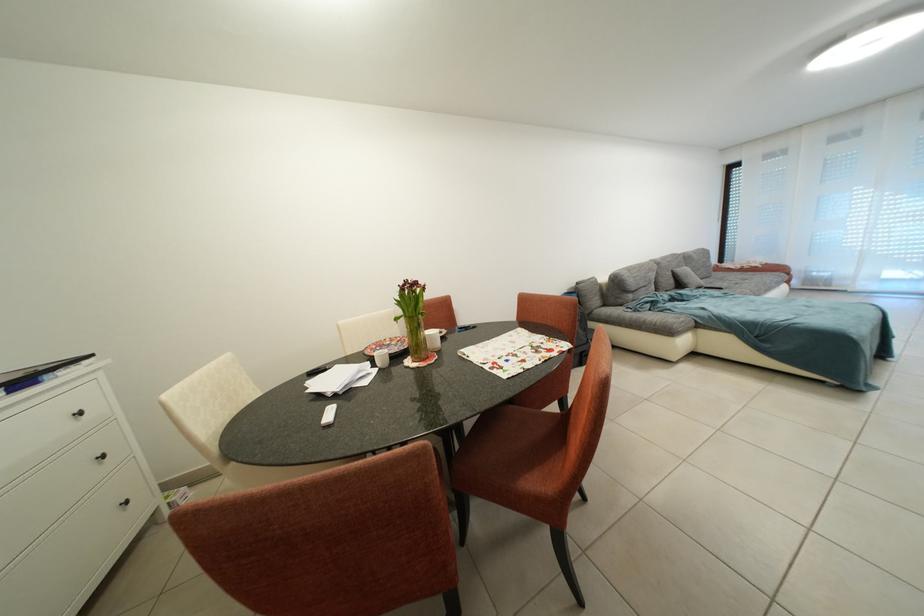
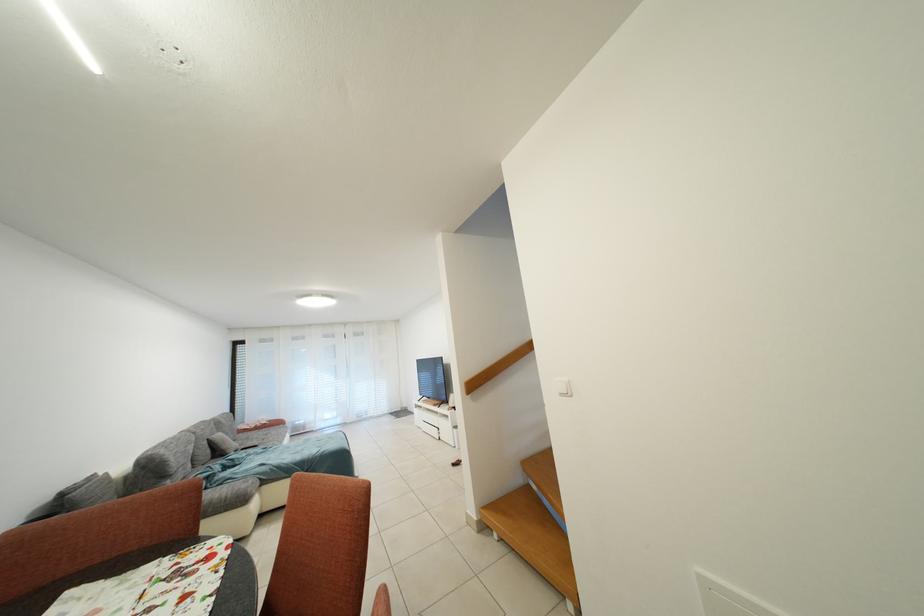
The point at (693,275) is marked in the first image. Where is the corresponding point in the second image?

(227, 440)